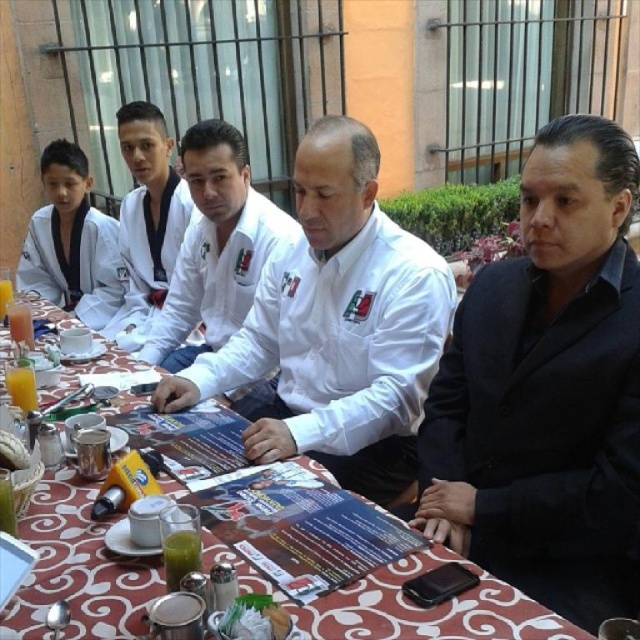
Is translucent glass juice at table left behind orange liquid at table left?

No.

Does point (10, 385) come in front of point (4, 280)?

Yes, it is.

The image size is (640, 640). I want to click on translucent glass juice at table left, so click(20, 387).

Where is `translucent glass juice at table left`? translucent glass juice at table left is located at coordinates (20, 387).

This screenshot has height=640, width=640. Describe the element at coordinates (147, 218) in the screenshot. I see `white fabric karate gi at left` at that location.

Which is behind, point (120, 138) or point (76, 273)?

Positioned behind is point (76, 273).

Is point (124, 252) more distant than point (68, 244)?

No, (124, 252) is closer to viewer.

Identify the location of white fabric karate gi at left. (147, 218).

Is black smooth suit at right shorter than orange liquid at table left?

Incorrect, black smooth suit at right's height does not fall short of orange liquid at table left's.

Is point (536, 540) closer to camera compared to point (10, 284)?

Yes, point (536, 540) is closer to viewer.

I want to click on black smooth suit at right, so click(548, 387).